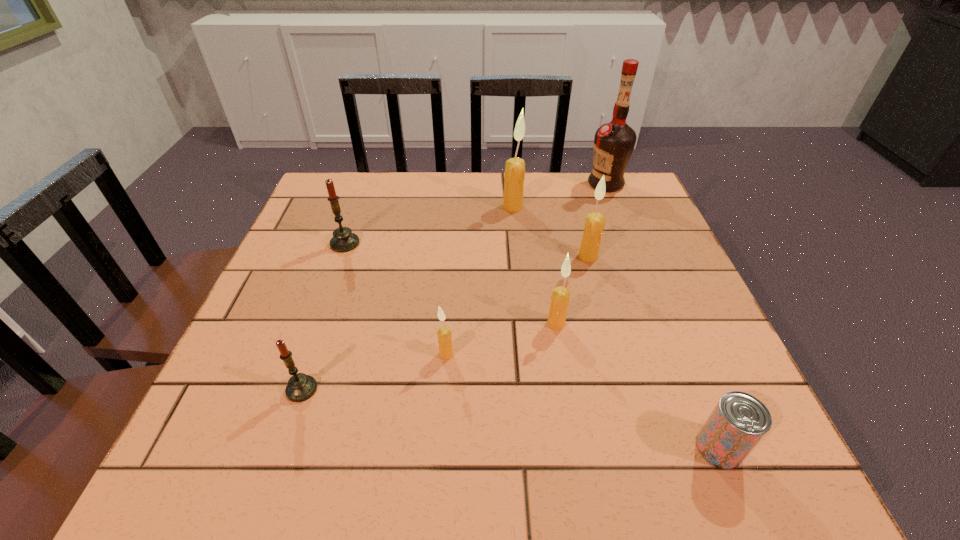
The width and height of the screenshot is (960, 540). What are the coordinates of `the farthest object` in the screenshot? It's located at (614, 142).

This screenshot has height=540, width=960. What are the coordinates of `liquor` in the screenshot? It's located at (614, 142).

This screenshot has width=960, height=540. I want to click on the third candle from right to left, so click(514, 176).

Where is `the second cream candle from left to right`? The image size is (960, 540). the second cream candle from left to right is located at coordinates (514, 176).

Identify the location of the sixth shortest object. (594, 225).

Locate an element on the screen. the third smallest cream candle is located at coordinates (594, 225).

This screenshot has width=960, height=540. What are the coordinates of `the farther red candle` in the screenshot? It's located at (343, 240).

In order to click on the fifth object from left to right in this screenshot , I will do pos(560,297).

This screenshot has width=960, height=540. Identify the location of the second candle from right to left. (560, 297).

Where is `the nearer red candle`? The image size is (960, 540). the nearer red candle is located at coordinates (301, 387).